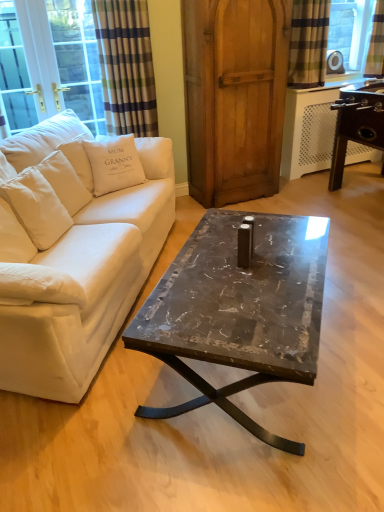
This screenshot has height=512, width=384. Identify the location of free location above marble-coated coffee table at center (from a real-world perspective). (240, 271).